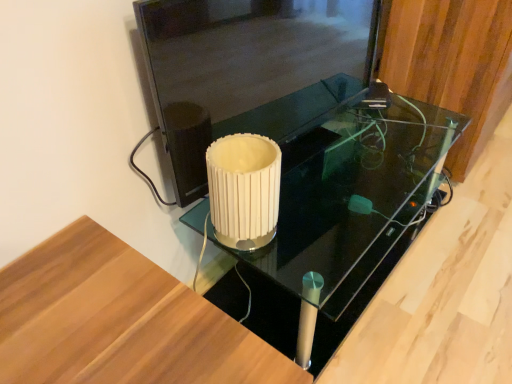
Question: From the image's perspective, is transparent glass door at center located above white ribbed glass at center?

Choices:
 (A) no
 (B) yes

Answer: (B)

Question: Is transparent glass door at center beside white ribbed glass at center?

Choices:
 (A) no
 (B) yes

Answer: (A)

Question: From a real-world perspective, does transparent glass door at center stand above white ribbed glass at center?

Choices:
 (A) yes
 (B) no

Answer: (A)

Question: Is transparent glass door at center far from white ribbed glass at center?

Choices:
 (A) yes
 (B) no

Answer: (B)

Question: Is white ribbed glass at center completely or partially inside transparent glass door at center?

Choices:
 (A) yes
 (B) no

Answer: (B)

Question: Is wooden panel at upper right spatially inside black glass table at center, or outside of it?

Choices:
 (A) outside
 (B) inside

Answer: (A)

Question: In terms of size, does wooden panel at upper right appear bigger or smaller than black glass table at center?

Choices:
 (A) small
 (B) big

Answer: (B)

Question: In the image, is wooden panel at upper right positioned in front of or behind black glass table at center?

Choices:
 (A) behind
 (B) front

Answer: (A)

Question: From a real-world perspective, is wooden panel at upper right positioned above or below black glass table at center?

Choices:
 (A) above
 (B) below

Answer: (A)

Question: Considering the relative positions of black glass table at center and transparent glass door at center in the image provided, is black glass table at center to the left or to the right of transparent glass door at center?

Choices:
 (A) left
 (B) right

Answer: (B)

Question: Would you say black glass table at center is inside or outside transparent glass door at center?

Choices:
 (A) inside
 (B) outside

Answer: (B)

Question: In terms of height, does black glass table at center look taller or shorter compared to transparent glass door at center?

Choices:
 (A) tall
 (B) short

Answer: (B)

Question: From the image's perspective, relative to transparent glass door at center, is black glass table at center above or below?

Choices:
 (A) above
 (B) below

Answer: (B)

Question: From the image's perspective, is black glass table at center located above or below wooden panel at upper right?

Choices:
 (A) below
 (B) above

Answer: (A)

Question: Visually, is black glass table at center positioned to the left or to the right of wooden panel at upper right?

Choices:
 (A) right
 (B) left

Answer: (B)